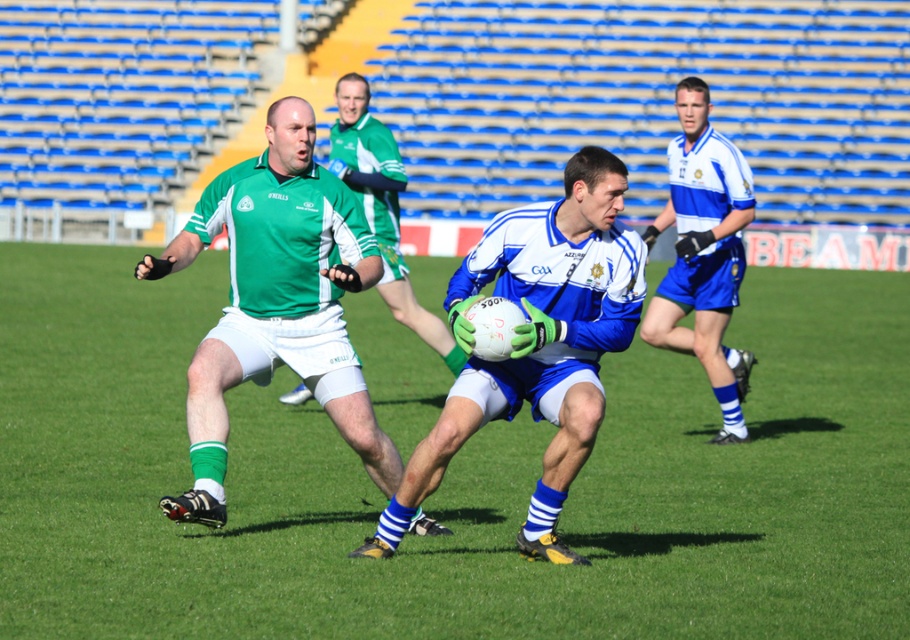
Question: Does white/blue striped jersey at center have a smaller size compared to green jersey at center?

Choices:
 (A) yes
 (B) no

Answer: (A)

Question: Which point is farther from the camera taking this photo?

Choices:
 (A) (376, 161)
 (B) (757, 604)

Answer: (A)

Question: Considering the real-world distances, which object is farthest from the green grass football field at center?

Choices:
 (A) blue matte jersey at center
 (B) green jersey at center
 (C) white/blue striped jersey at center
 (D) green jersey at left

Answer: (C)

Question: Considering the real-world distances, which object is farthest from the white/blue striped jersey at center?

Choices:
 (A) green jersey at left
 (B) green grass football field at center
 (C) blue matte jersey at center
 (D) green jersey at center

Answer: (B)

Question: Can you confirm if green grass football field at center is positioned below green jersey at center?

Choices:
 (A) no
 (B) yes

Answer: (B)

Question: Is green jersey at left thinner than white/blue striped jersey at center?

Choices:
 (A) no
 (B) yes

Answer: (A)